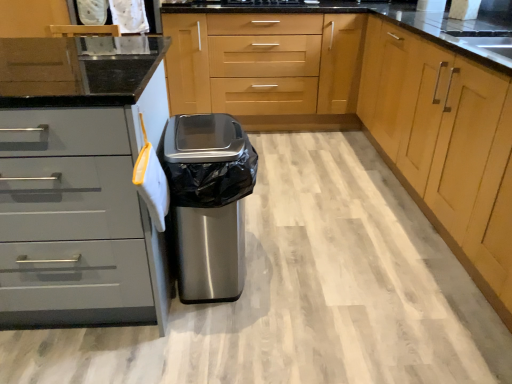
Question: In the image, is brushed metal cabinet at center, marked as the third cabinetry in a left-to-right arrangement, positioned in front of or behind light wood cabinet at center, which appears as the first cabinetry when viewed from the right?

Choices:
 (A) front
 (B) behind

Answer: (A)

Question: Considering the positions of point (444, 59) and point (411, 105), is point (444, 59) closer or farther from the camera than point (411, 105)?

Choices:
 (A) farther
 (B) closer

Answer: (B)

Question: Based on their relative distances, which object is farther from the stainless steel trash can at center?

Choices:
 (A) light wood cabinet at center, which is the second cabinetry from left to right
 (B) light wood cabinet at center, which appears as the first cabinetry when viewed from the right
 (C) matte gray drawers at left, arranged as the first cabinetry when viewed from the left
 (D) brushed metal cabinet at center, marked as the third cabinetry in a left-to-right arrangement

Answer: (A)

Question: Which object is the farthest from the matte gray drawers at left, arranged as the first cabinetry when viewed from the left?

Choices:
 (A) stainless steel trash can at center
 (B) light wood cabinet at center, the third cabinetry positioned from the right
 (C) light wood cabinet at center, which appears as the first cabinetry when viewed from the right
 (D) brushed metal cabinet at center, marked as the third cabinetry in a left-to-right arrangement

Answer: (B)